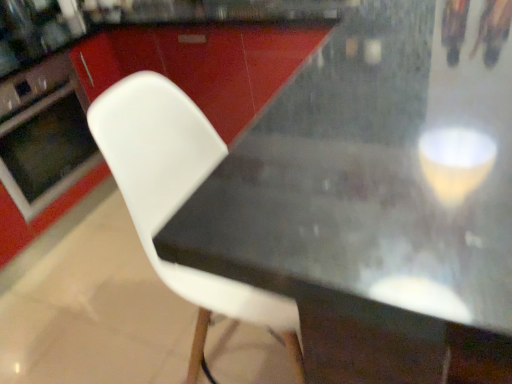
Where is `matte black oven at left`? matte black oven at left is located at coordinates (44, 135).

Image resolution: width=512 pixels, height=384 pixels. Describe the element at coordinates (379, 198) in the screenshot. I see `black matte table at center` at that location.

At what (x,y) coordinates should I click in order to perform the action: click on white plastic chair at center. Please return your answer as a coordinate pair (x, y). Looking at the image, I should click on (177, 197).

Could you tell me if white plastic chair at center is facing matte black oven at left?

No, white plastic chair at center does not turn towards matte black oven at left.

Is point (196, 164) closer or farther from the camera than point (2, 156)?

Point (196, 164) appears to be closer to the viewer than point (2, 156).

From a real-world perspective, who is located higher, white plastic chair at center or matte black oven at left?

matte black oven at left is physically above.

Looking at this image, who is more distant, white plastic chair at center or matte black oven at left?

matte black oven at left is behind.

Is white plastic chair at center surrounded by matte black oven at left?

No, white plastic chair at center is not a part of matte black oven at left.

Looking at their sizes, would you say matte black oven at left is wider or thinner than white plastic chair at center?

matte black oven at left is wider than white plastic chair at center.

Can you confirm if matte black oven at left is bigger than white plastic chair at center?

Incorrect, matte black oven at left is not larger than white plastic chair at center.

The height and width of the screenshot is (384, 512). Identify the location of chair below the black matte table at center (from a real-world perspective). pos(177,197).

Is white plastic chair at center located outside black matte table at center?

Indeed, white plastic chair at center is completely outside black matte table at center.

From a real-world perspective, is white plastic chair at center above or below black matte table at center?

Clearly, from a real-world perspective, white plastic chair at center is below black matte table at center.

Considering the relative sizes of white plastic chair at center and black matte table at center in the image provided, is white plastic chair at center wider than black matte table at center?

No.

In the image, is black matte table at center positioned in front of or behind matte black oven at left?

Clearly, black matte table at center is in front of matte black oven at left.

From the image's perspective, does black matte table at center appear higher than matte black oven at left?

Actually, black matte table at center appears below matte black oven at left in the image.

Does point (431, 83) come farther from viewer compared to point (20, 133)?

No, it is not.

Does black matte table at center turn towards white plastic chair at center?

No, black matte table at center is not oriented towards white plastic chair at center.

Find the location of a particular element. The height and width of the screenshot is (384, 512). chair on the left of black matte table at center is located at coordinates (177, 197).

Considering the relative positions of black matte table at center and white plastic chair at center in the image provided, is black matte table at center to the left of white plastic chair at center from the viewer's perspective?

No.

In terms of height, does matte black oven at left look taller or shorter compared to black matte table at center?

In the image, matte black oven at left appears to be taller than black matte table at center.

From the picture: Is matte black oven at left with black matte table at center?

No, matte black oven at left is not beside black matte table at center.

In the image, is matte black oven at left on the left side or the right side of black matte table at center?

From the image, it's evident that matte black oven at left is to the left of black matte table at center.

How different are the orientations of matte black oven at left and black matte table at center in degrees?

88.8 degrees.

Find the location of a particular element. Image resolution: width=512 pixels, height=384 pixels. oven located behind the white plastic chair at center is located at coordinates (44, 135).

Identify the location of oven located above the white plastic chair at center (from the image's perspective). The image size is (512, 384). (44, 135).

When comparing their distances from black matte table at center, does white plastic chair at center or matte black oven at left seem further?

Based on the image, matte black oven at left appears to be further to black matte table at center.

Estimate the real-world distances between objects in this image. Which object is further from black matte table at center, matte black oven at left or white plastic chair at center?

matte black oven at left.

Estimate the real-world distances between objects in this image. Which object is closer to white plastic chair at center, matte black oven at left or black matte table at center?

Based on the image, black matte table at center appears to be nearer to white plastic chair at center.

Which object lies further to the anchor point white plastic chair at center, black matte table at center or matte black oven at left?

matte black oven at left lies further to white plastic chair at center than the other object.

Estimate the real-world distances between objects in this image. Which object is closer to matte black oven at left, black matte table at center or white plastic chair at center?

white plastic chair at center.

Based on their spatial positions, is white plastic chair at center or black matte table at center further from matte black oven at left?

black matte table at center lies further to matte black oven at left than the other object.

Where is `chair situated between matte black oven at left and black matte table at center from left to right`? chair situated between matte black oven at left and black matte table at center from left to right is located at coordinates (177, 197).